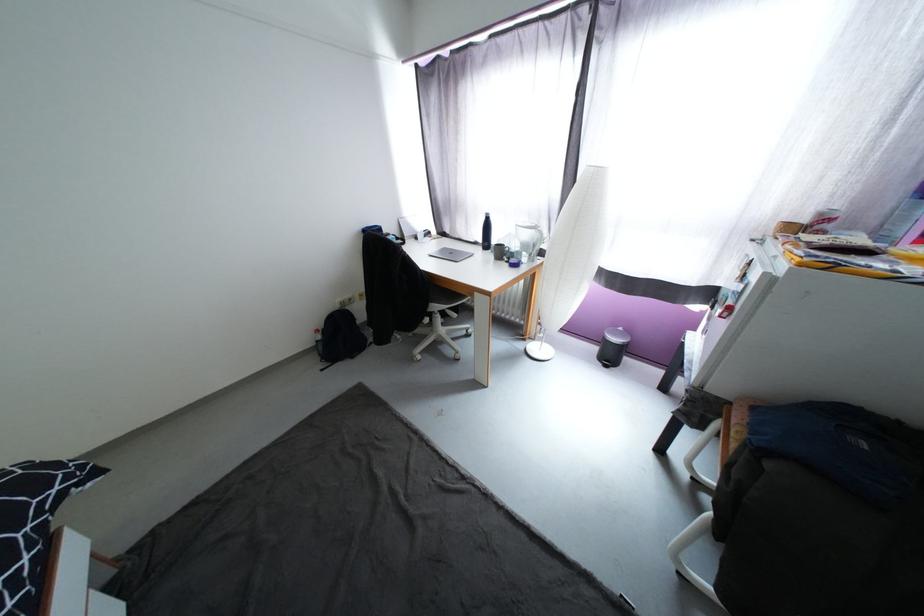
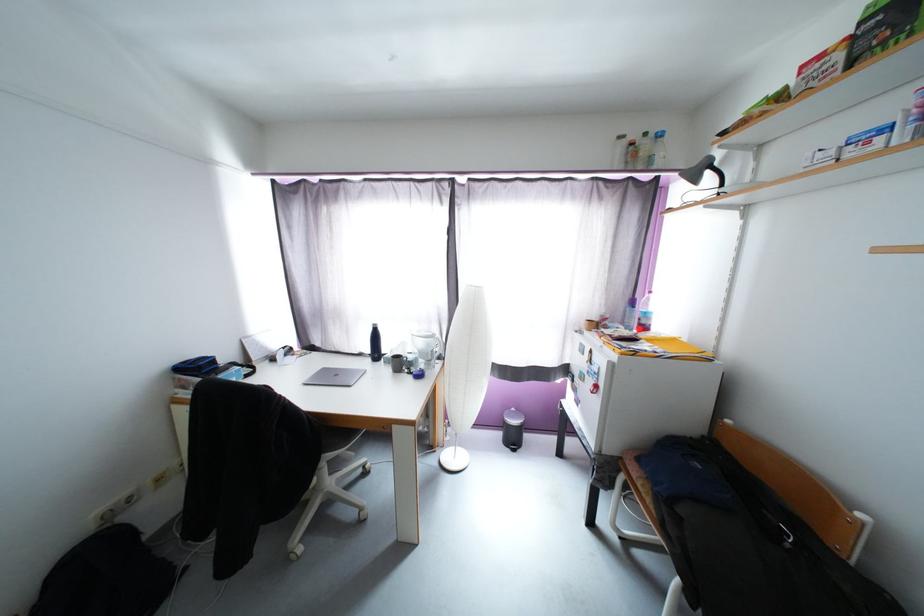
Where in the second image is the point corresponding to (x=463, y=354) from the first image?

(367, 511)